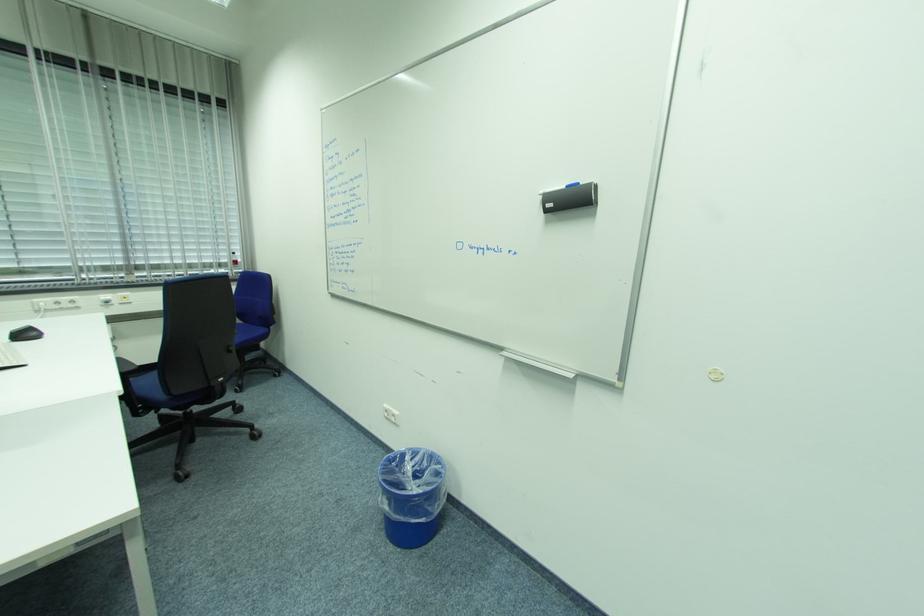
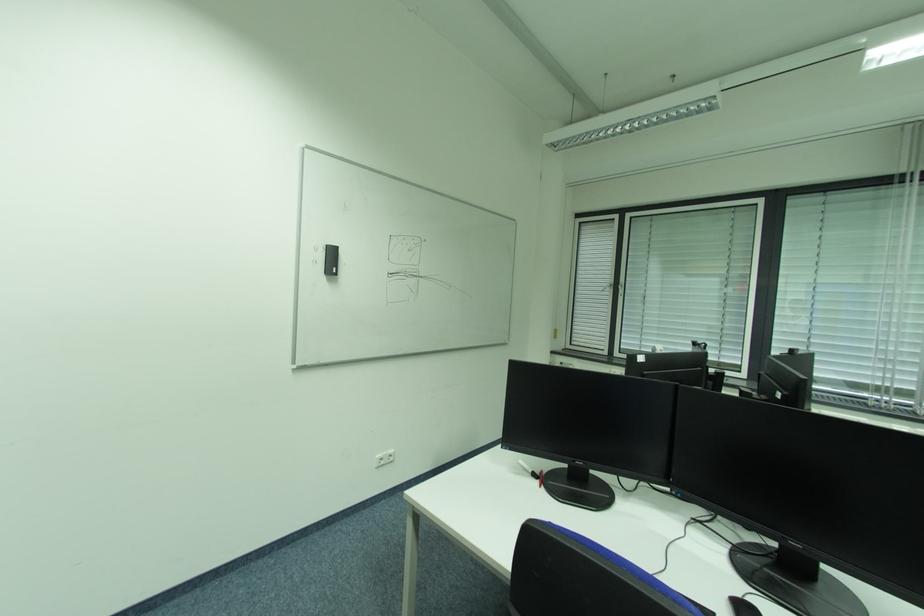
Question: How did the camera likely rotate?

Choices:
 (A) Left
 (B) Right
 (C) Up
 (D) Down

Answer: (A)